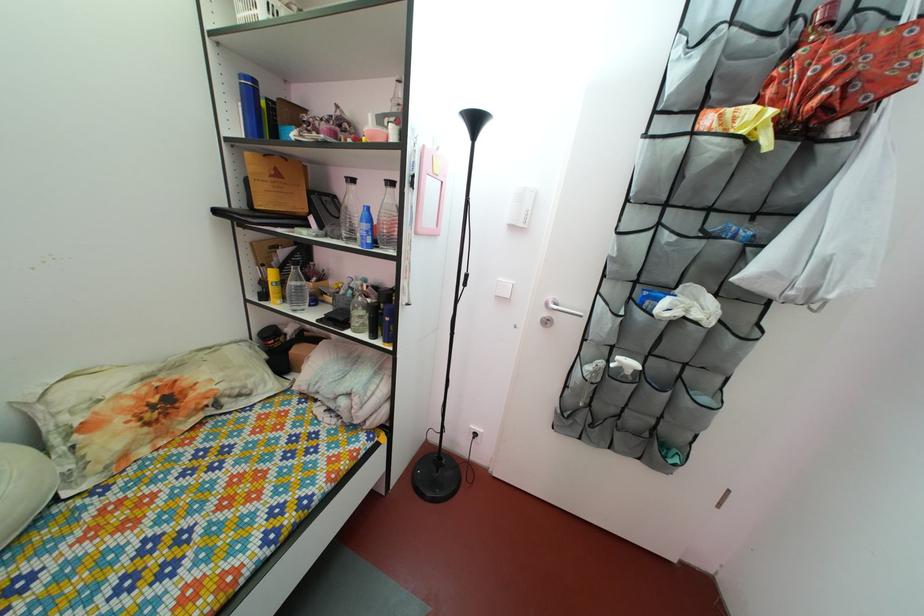
Locate an element on the screen. The height and width of the screenshot is (616, 924). clear water bottle is located at coordinates (296, 289).